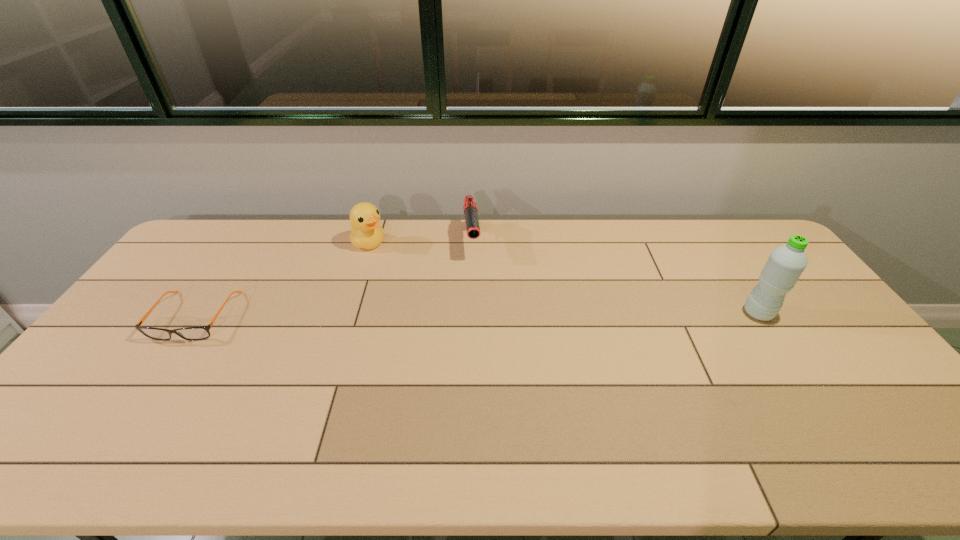
Select which object is the closest to the second object from right to left. Please provide its 2D coordinates. Your answer should be formatted as a tuple, i.e. [(x, y)], where the tuple contains the x and y coordinates of a point satisfying the conditions above.

[(366, 233)]

Locate an element on the screen. This screenshot has height=540, width=960. object that can be found as the closest to the second object from left to right is located at coordinates (470, 207).

Find the location of a particular element. The image size is (960, 540). vacant position in the image that satisfies the following two spatial constraints: 1. on the front side of the second object from right to left; 2. on the right side of the water bottle is located at coordinates (470, 313).